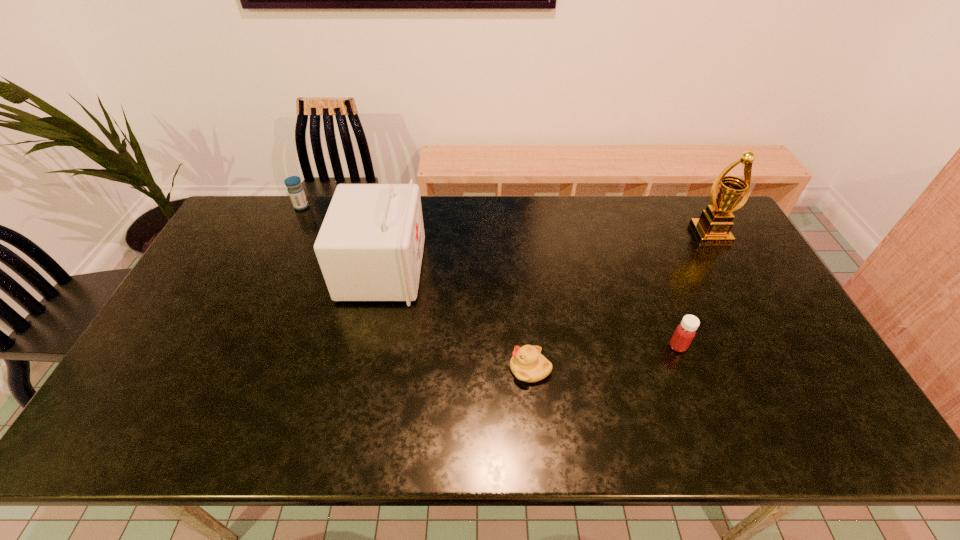
The height and width of the screenshot is (540, 960). Identify the location of vacant region between the first-aid kit and the duckling. (456, 319).

At what (x,y) coordinates should I click in order to perform the action: click on free area in between the right medicine and the second object from left to right. Please return your answer as a coordinate pair (x, y). This screenshot has width=960, height=540. Looking at the image, I should click on (530, 308).

The width and height of the screenshot is (960, 540). I want to click on free space between the farther medicine and the award, so click(x=506, y=220).

Locate an element on the screen. This screenshot has height=540, width=960. object that is the second nearest to the left medicine is located at coordinates coord(527,364).

Identify the location of object identified as the third closest to the leftmost object. (685, 332).

At what (x,y) coordinates should I click in order to perform the action: click on vacant space that satisfies the following two spatial constraints: 1. on the front-facing side of the award; 2. on the front-facing side of the shortest object. Please return your answer as a coordinate pair (x, y). Image resolution: width=960 pixels, height=540 pixels. Looking at the image, I should click on (785, 369).

Find the location of a particular element. The width and height of the screenshot is (960, 540). vacant position in the image that satisfies the following two spatial constraints: 1. on the front side of the nearer medicine; 2. on the front-facing side of the duckling is located at coordinates (686, 369).

Identify the location of free spot that satisfies the following two spatial constraints: 1. on the front side of the farther medicine; 2. on the right side of the nearer medicine. (237, 346).